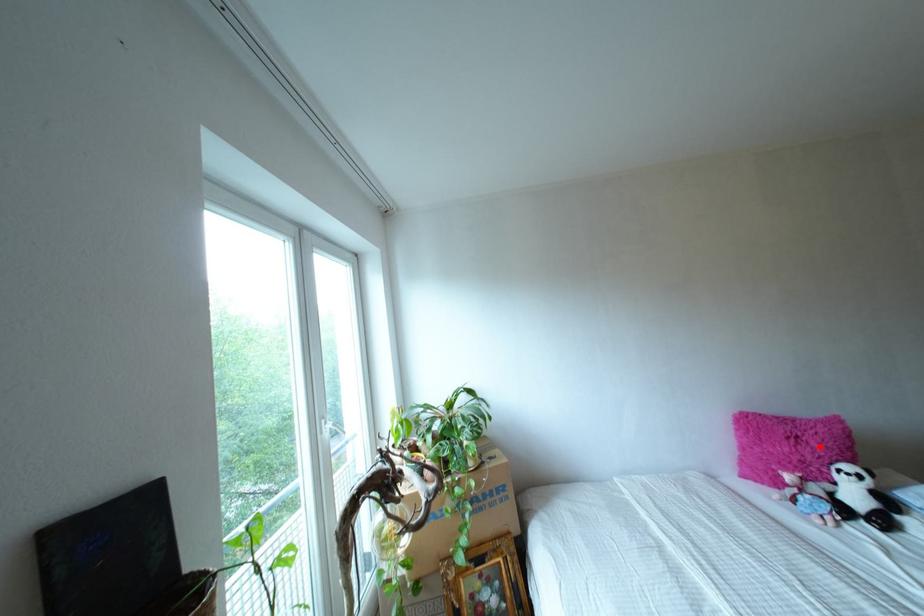
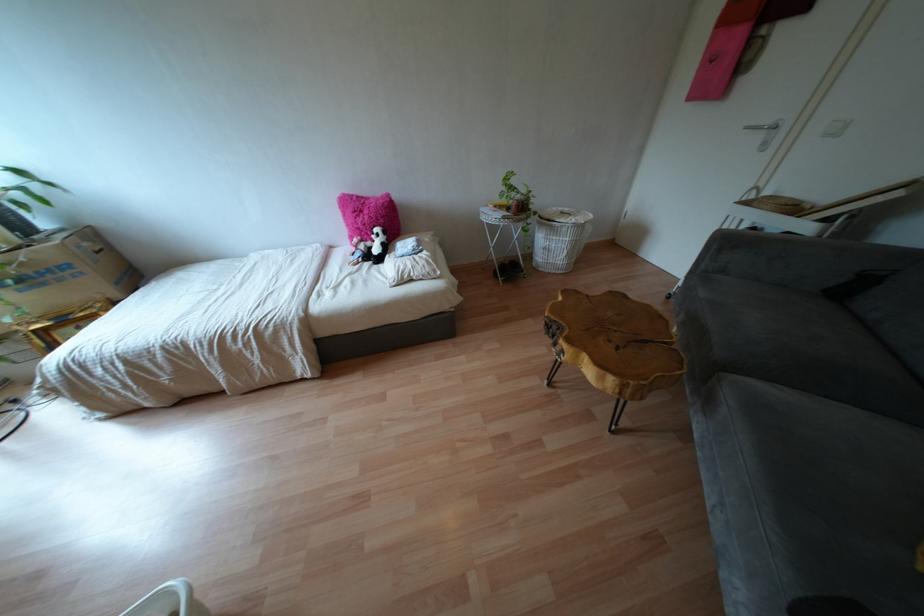
Where in the second image is the point corresponding to the highlighted location from the first image?

(365, 217)